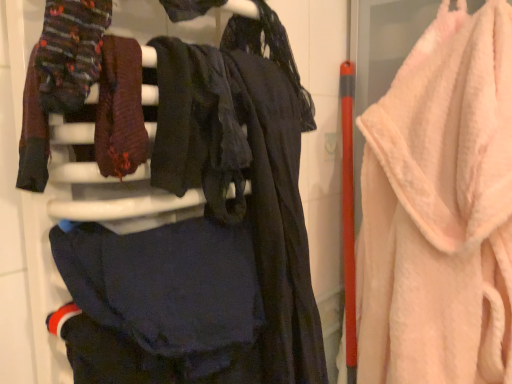
Question: From the image's perspective, is dark matte fabric at center, which ranks as the 1th clothing in bottom-to-top order, located above knitted wool socks at upper left, which is counted as the 2th clothing, starting from the bottom?

Choices:
 (A) no
 (B) yes

Answer: (A)

Question: Is dark matte fabric at center, the 2th clothing in the top-to-bottom sequence, beside knitted wool socks at upper left, which is counted as the 2th clothing, starting from the bottom?

Choices:
 (A) yes
 (B) no

Answer: (B)

Question: Is dark matte fabric at center, the 2th clothing in the top-to-bottom sequence, at the right side of knitted wool socks at upper left, arranged as the 1th clothing when viewed from the top?

Choices:
 (A) no
 (B) yes

Answer: (B)

Question: Is dark matte fabric at center, which ranks as the 1th clothing in bottom-to-top order, wider than knitted wool socks at upper left, which is counted as the 2th clothing, starting from the bottom?

Choices:
 (A) no
 (B) yes

Answer: (B)

Question: From a real-world perspective, is dark matte fabric at center, which ranks as the 1th clothing in bottom-to-top order, below knitted wool socks at upper left, which is counted as the 2th clothing, starting from the bottom?

Choices:
 (A) no
 (B) yes

Answer: (B)

Question: Does dark matte fabric at center, the 2th clothing in the top-to-bottom sequence, contain knitted wool socks at upper left, arranged as the 1th clothing when viewed from the top?

Choices:
 (A) yes
 (B) no

Answer: (B)

Question: Does pink fluffy towel at right touch knitted wool socks at upper left, which is counted as the 2th clothing, starting from the bottom?

Choices:
 (A) yes
 (B) no

Answer: (B)

Question: Is pink fluffy towel at right far from knitted wool socks at upper left, which is counted as the 2th clothing, starting from the bottom?

Choices:
 (A) yes
 (B) no

Answer: (B)

Question: From a real-world perspective, does pink fluffy towel at right stand above knitted wool socks at upper left, which is counted as the 2th clothing, starting from the bottom?

Choices:
 (A) no
 (B) yes

Answer: (A)

Question: Is pink fluffy towel at right behind knitted wool socks at upper left, arranged as the 1th clothing when viewed from the top?

Choices:
 (A) yes
 (B) no

Answer: (A)

Question: Is pink fluffy towel at right bigger than knitted wool socks at upper left, arranged as the 1th clothing when viewed from the top?

Choices:
 (A) no
 (B) yes

Answer: (B)

Question: Would you say pink fluffy towel at right contains knitted wool socks at upper left, which is counted as the 2th clothing, starting from the bottom?

Choices:
 (A) yes
 (B) no

Answer: (B)

Question: Can you confirm if knitted wool socks at upper left, which is counted as the 2th clothing, starting from the bottom, is wider than pink fluffy towel at right?

Choices:
 (A) no
 (B) yes

Answer: (A)